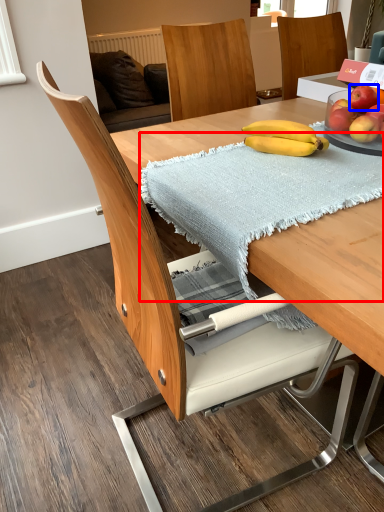
Question: Among these objects, which one is nearest to the camera, blanket (highlighted by a red box) or apple (highlighted by a blue box)?

Choices:
 (A) blanket
 (B) apple

Answer: (A)